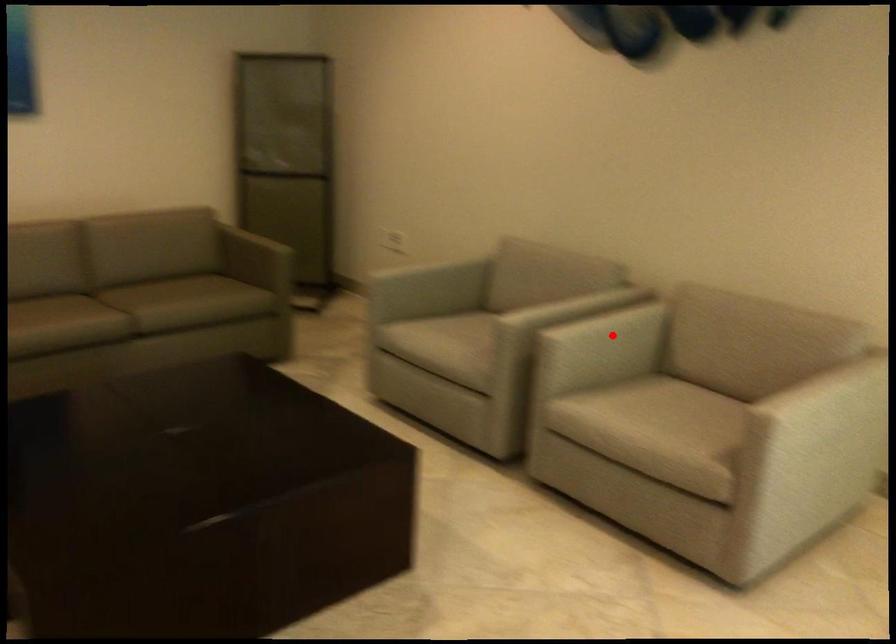
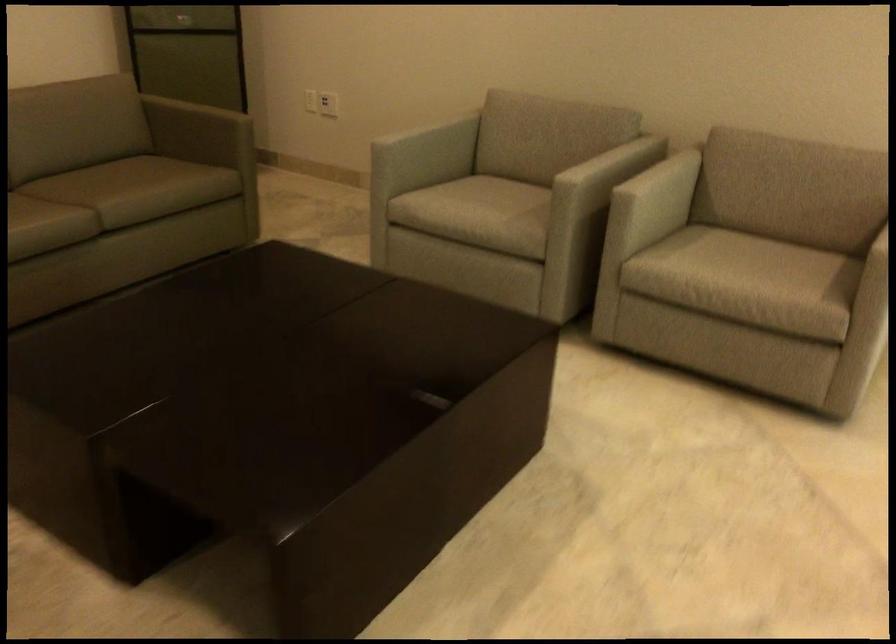
Find the pixel in the second image that matches the highlighted location in the first image.

(661, 187)